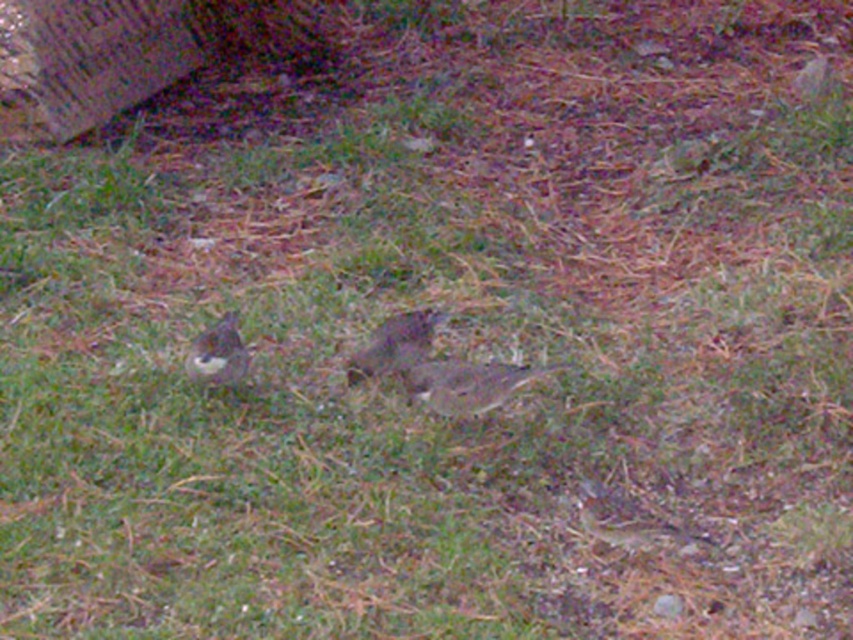
You are a photographer aiming to capture both the brown feathered bird at center and the brown speckled bird at lower left in a single frame. Based on their positions, which bird would appear closer to the camera in the photo?

The brown feathered bird at center appears closer to the camera because it is positioned under the brown speckled bird at lower left, indicating it is in a lower plane and thus nearer in the image.